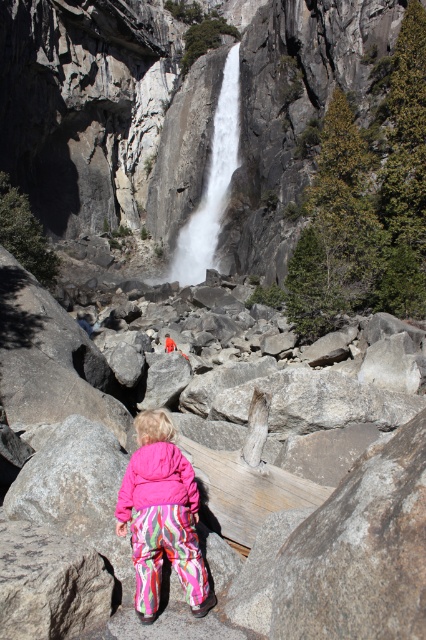
You are a photographer trying to capture the waterfall and the child in the same frame. You notice two points marked on your camera screen at coordinates point (160, 492) and point (181, 262). Which point should you focus on to ensure the child wearing the bright pink jacket is in focus while keeping the waterfall in the background?

Point (160, 492) is in front of point (181, 262). Therefore, focusing on point (160, 492) ensures the child wearing the bright pink jacket is in focus while the waterfall remains in the background.

You are a photographer trying to capture the pink fleece jacket at center and the white smooth waterfall at center in a single shot. Based on their positions, which object should you adjust your camera angle to focus on first if you want to include both in your frame?

The pink fleece jacket at center is to the left of the white smooth waterfall at center. To include both in the frame, you should first focus on the pink fleece jacket at center since it is positioned to the left, ensuring it stays within the camera angle while framing the waterfall.